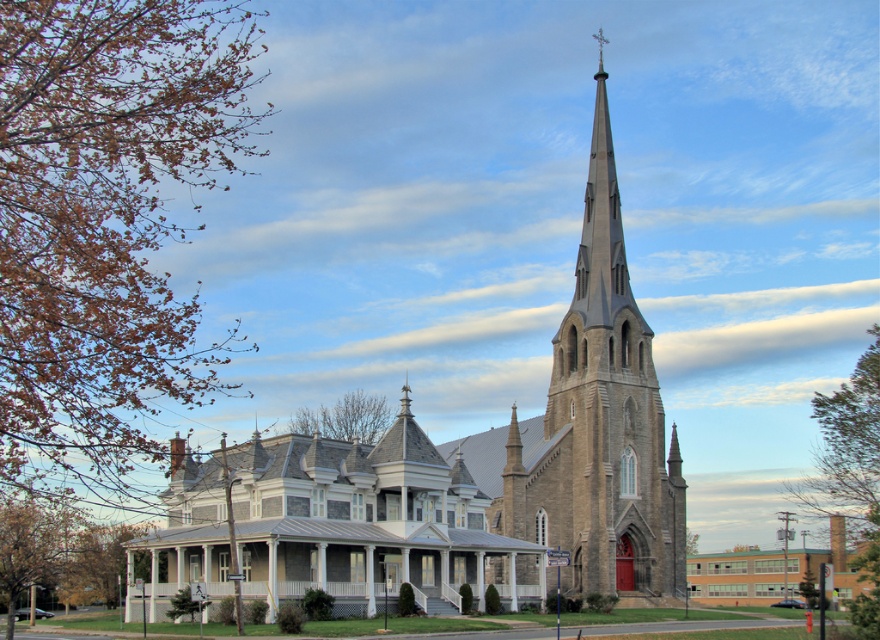
Question: Which point appears closest to the camera in this image?

Choices:
 (A) (585, 493)
 (B) (346, 600)
 (C) (224, 576)
 (D) (422, 548)

Answer: (B)

Question: Is stone steeple at center to the right of white wood porch at center from the viewer's perspective?

Choices:
 (A) yes
 (B) no

Answer: (A)

Question: Is stone steeple at center behind gray stone steeple at center?

Choices:
 (A) no
 (B) yes

Answer: (A)

Question: Can you confirm if stone steeple at center is thinner than gray stone church at center?

Choices:
 (A) no
 (B) yes

Answer: (A)

Question: Among these objects, which one is nearest to the camera?

Choices:
 (A) gray stone church at center
 (B) gray stone steeple at center

Answer: (A)

Question: Which point appears closest to the camera in this image?

Choices:
 (A) (418, 604)
 (B) (390, 477)
 (C) (519, 576)

Answer: (A)